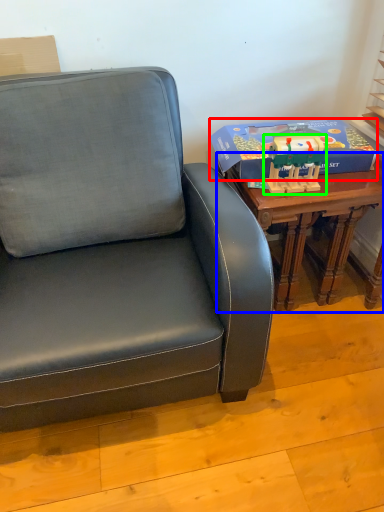
Question: Considering the real-world distances, which object is closest to box (highlighted by a red box)? table (highlighted by a blue box) or toy (highlighted by a green box).

Choices:
 (A) table
 (B) toy

Answer: (B)